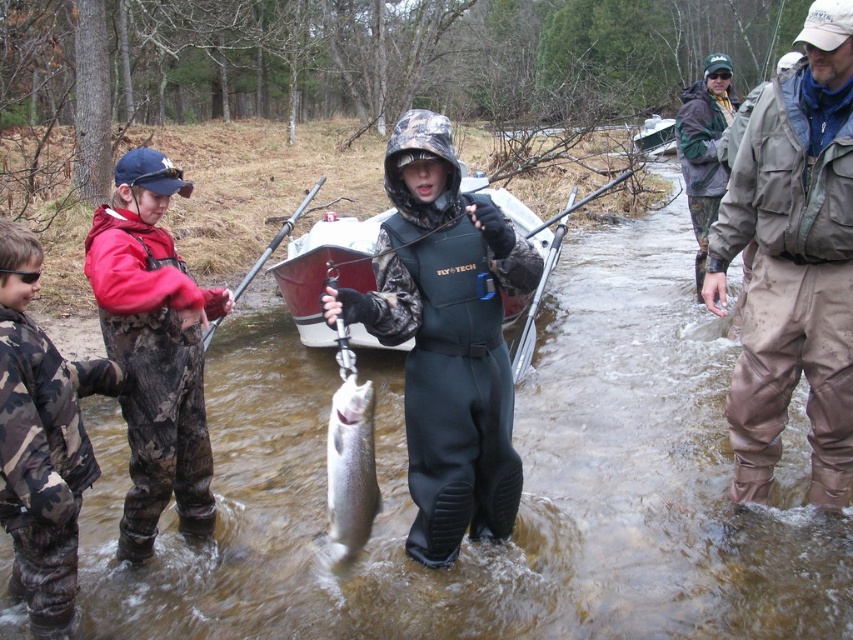
Question: Can you confirm if red camo waders at left is bigger than camo pants at left?

Choices:
 (A) yes
 (B) no

Answer: (A)

Question: Estimate the real-world distances between objects in this image. Which object is farther from the red camo waders at left?

Choices:
 (A) khaki waterproof pants at right
 (B) black neoprene wetsuit at center

Answer: (A)

Question: Which point appears farthest from the camera in this image?

Choices:
 (A) (477, 396)
 (B) (724, 83)
 (C) (149, 172)
 (D) (49, 445)

Answer: (B)

Question: Is camo pants at left positioned in front of white plastic canoe at center?

Choices:
 (A) no
 (B) yes

Answer: (B)

Question: Does khaki waterproof pants at right have a larger size compared to red camo waders at left?

Choices:
 (A) no
 (B) yes

Answer: (B)

Question: Which object is the farthest from the white plastic canoe at center?

Choices:
 (A) black neoprene wetsuit at center
 (B) camo pants at left

Answer: (B)